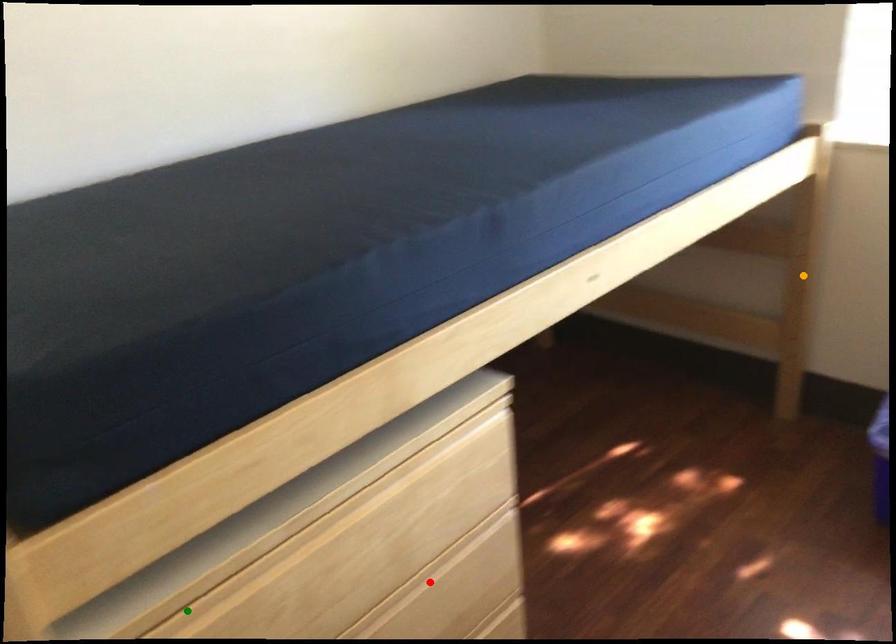
Order these from nearest to farthest:
orange point
red point
green point

green point
red point
orange point